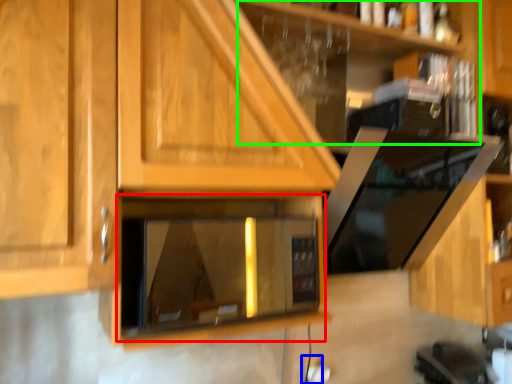
Question: Which is nearer to the appliance (highlighted by a red box)? electric outlet (highlighted by a blue box) or shelf (highlighted by a green box).

Choices:
 (A) electric outlet
 (B) shelf

Answer: (B)